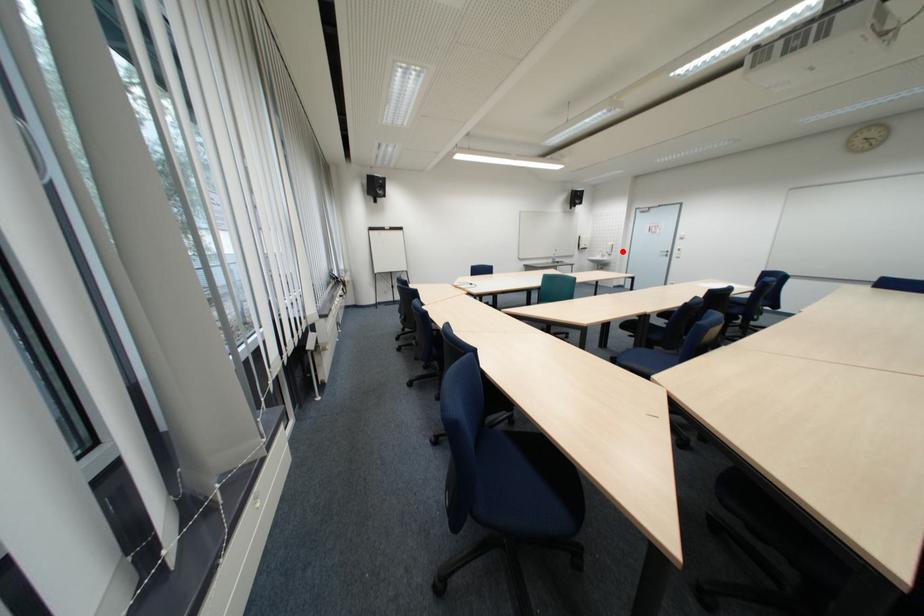
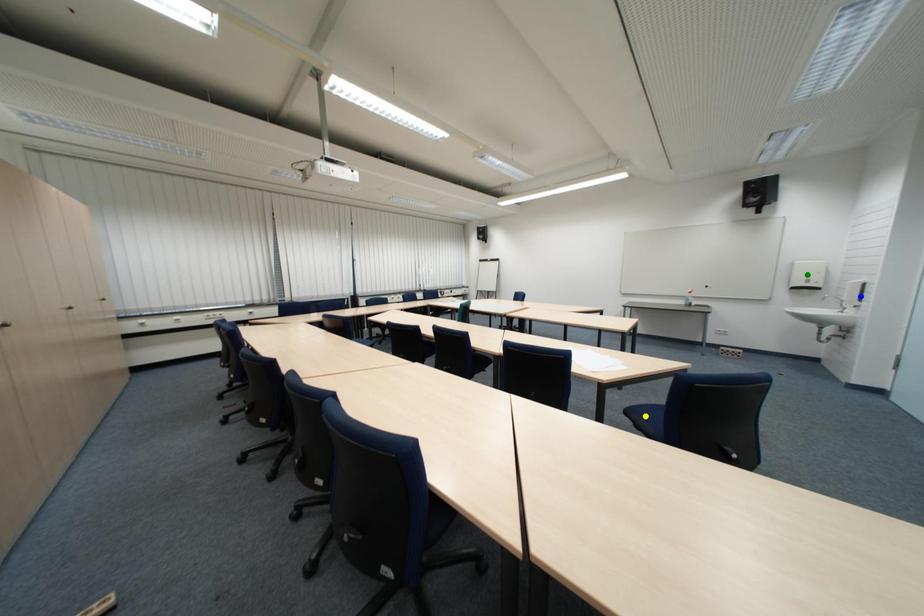
Question: I am providing you with two images of the same scene from different viewpoints. A red point is marked on the first image. You are given multiple points on the second image. Which spot in image 2 lines up with the point in image 1?

Choices:
 (A) blue point
 (B) green point
 (C) yellow point

Answer: (A)